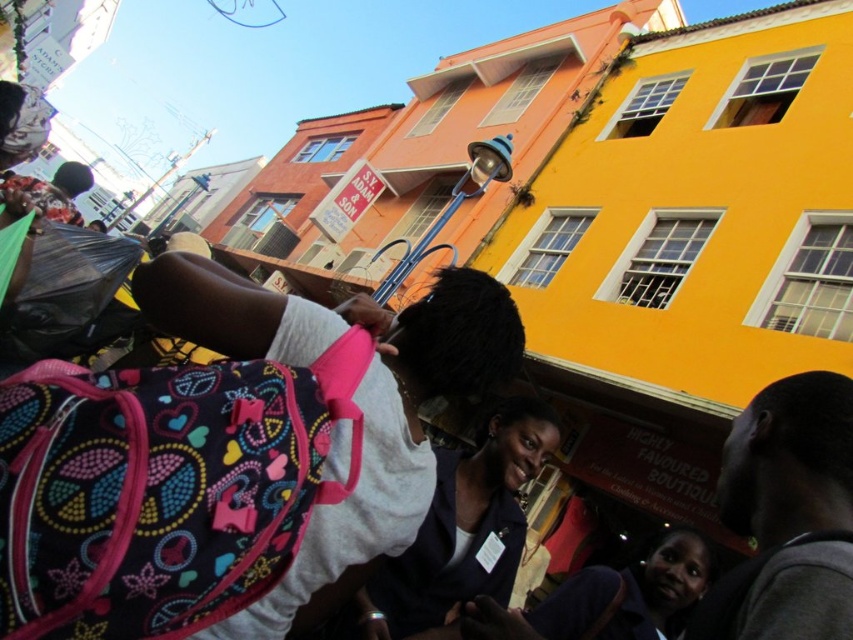
Who is taller, dark gray sweater at lower right or dark blue fabric jacket at center?

dark blue fabric jacket at center is taller.

Who is more forward, (x=763, y=589) or (x=526, y=461)?

Point (x=763, y=589)

Is point (735, 573) positioned after point (503, 577)?

No, it is not.

You are a GUI agent. You are given a task and a screenshot of the screen. Output one action in this format:
    pyautogui.click(x=<x>, y=<y>)
    Task: Click on the dark gray sweater at lower right
    The height and width of the screenshot is (640, 853).
    Given the screenshot: What is the action you would take?
    pyautogui.click(x=787, y=515)

Which of these two, dark gray sweater at lower right or dark blue fabric jacket at lower center, stands shorter?

dark blue fabric jacket at lower center

Find the location of a particular element. dark gray sweater at lower right is located at coordinates (787, 515).

This screenshot has width=853, height=640. What do you see at coordinates (787, 515) in the screenshot?
I see `dark gray sweater at lower right` at bounding box center [787, 515].

Where is `dark gray sweater at lower right`? The image size is (853, 640). dark gray sweater at lower right is located at coordinates (787, 515).

Does dark blue fabric jacket at center appear under dark blue fabric jacket at lower center?

Actually, dark blue fabric jacket at center is above dark blue fabric jacket at lower center.

Who is more distant from viewer, (352, 627) or (614, 608)?

Point (614, 608)

Is point (428, 564) closer to viewer compared to point (625, 577)?

Yes, point (428, 564) is closer to viewer.

You are a GUI agent. You are given a task and a screenshot of the screen. Output one action in this format:
    pyautogui.click(x=<x>, y=<y>)
    Task: Click on the dark blue fabric jacket at center
    This screenshot has width=853, height=640.
    Given the screenshot: What is the action you would take?
    [x=462, y=531]